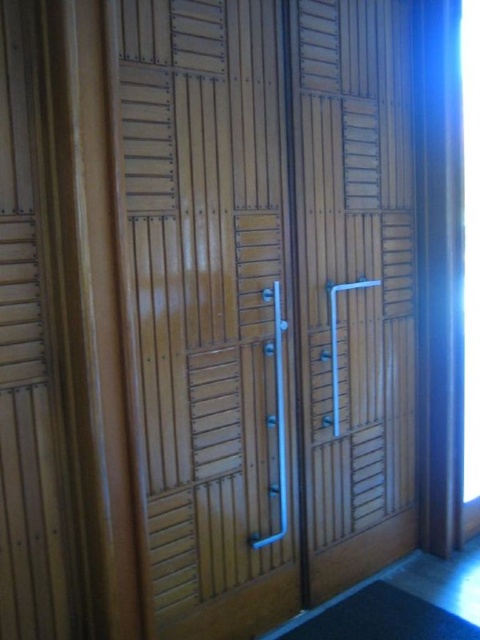
Does wooden at center appear under wooden slats at left?

Incorrect, wooden at center is not positioned below wooden slats at left.

Can you confirm if wooden at center is positioned to the right of wooden slats at left?

Yes, wooden at center is to the right of wooden slats at left.

You are a GUI agent. You are given a task and a screenshot of the screen. Output one action in this format:
    pyautogui.click(x=<x>, y=<y>)
    Task: Click on the wooden at center
    This screenshot has width=480, height=640.
    Given the screenshot: What is the action you would take?
    pyautogui.click(x=268, y=300)

Image resolution: width=480 pixels, height=640 pixels. Find the location of `wooden at center`. wooden at center is located at coordinates (268, 300).